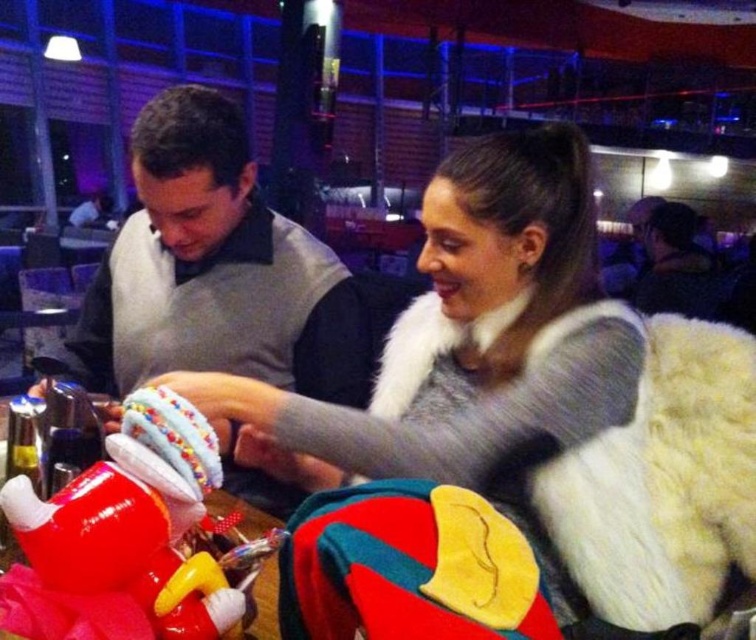
Which is behind, point (612, 467) or point (655, 205)?

The point (655, 205) is behind.

Locate an element on the screen. white fur coat at upper center is located at coordinates (655, 476).

Is white fur coat at center bigger than rubberized plastic toy at lower left?

Indeed, white fur coat at center has a larger size compared to rubberized plastic toy at lower left.

Does white fur coat at center have a greater height compared to rubberized plastic toy at lower left?

Indeed, white fur coat at center has a greater height compared to rubberized plastic toy at lower left.

This screenshot has width=756, height=640. Describe the element at coordinates (497, 381) in the screenshot. I see `white fur coat at center` at that location.

This screenshot has height=640, width=756. Identify the location of white fur coat at center. pos(497,381).

Is rubberized plastic toy at lower left shorter than fuzzy gray vest at upper right?

Correct, rubberized plastic toy at lower left is not as tall as fuzzy gray vest at upper right.

Can you confirm if rubberized plastic toy at lower left is bigger than fuzzy gray vest at upper right?

No, rubberized plastic toy at lower left is not bigger than fuzzy gray vest at upper right.

You are a GUI agent. You are given a task and a screenshot of the screen. Output one action in this format:
    pyautogui.click(x=<x>, y=<y>)
    Task: Click on the rubberized plastic toy at lower left
    
    Given the screenshot: What is the action you would take?
    pyautogui.click(x=132, y=540)